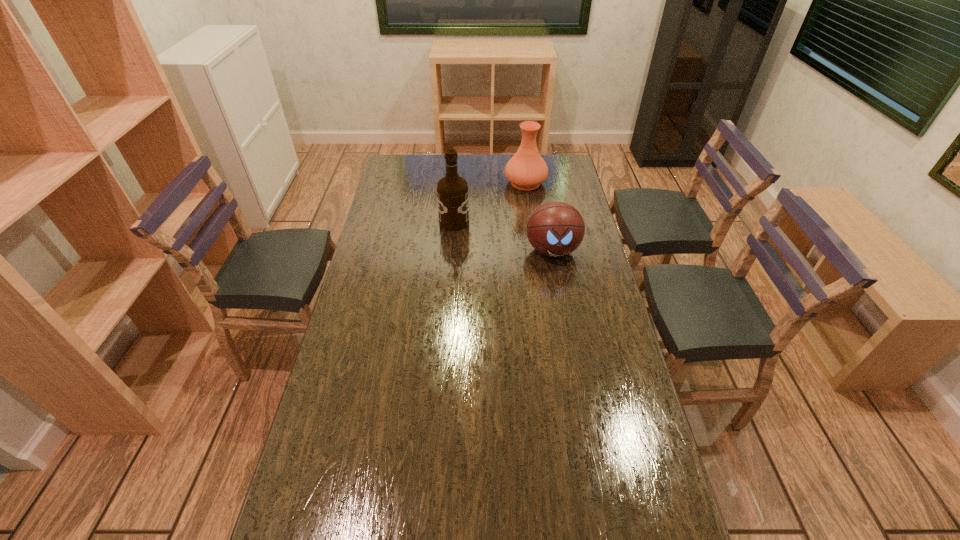
This screenshot has width=960, height=540. In order to click on free region that satisfies the following two spatial constraints: 1. on the front side of the second tallest object; 2. on the label of the second farthest object in this screenshot , I will do `click(531, 222)`.